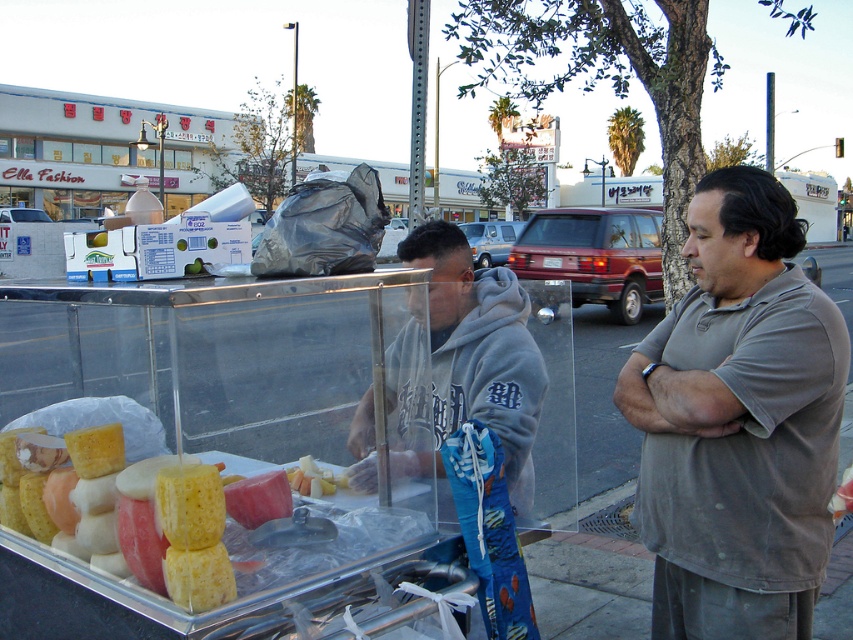
You are a customer at the fruit stand and want to ask the vendor a question. Which of the two people, the gray cotton shirt at right or the gray fleece hoodie at center, should you approach?

The gray fleece hoodie at center is the vendor, so you should approach them.